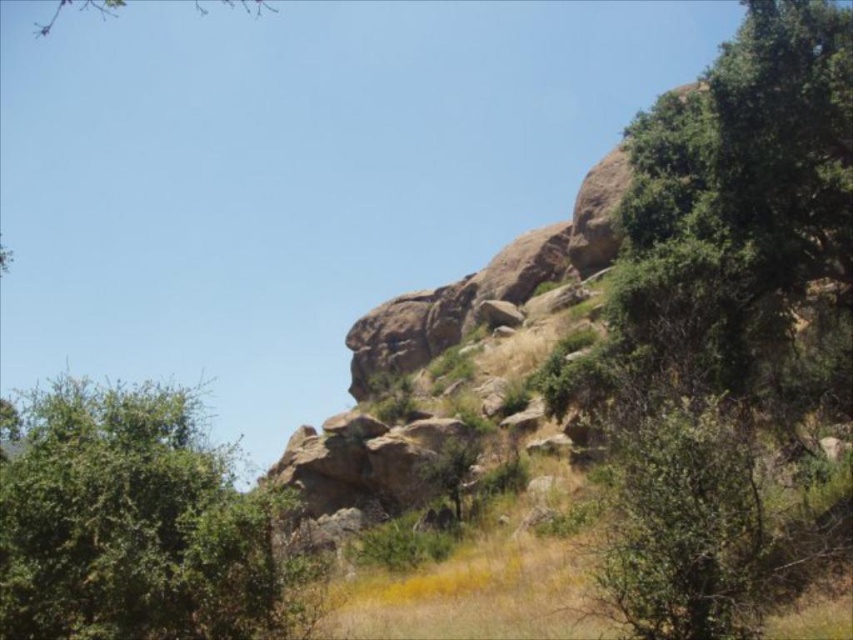
You are standing on the rocky hillside and want to pick a leaf from either the green leafy bush at left or the green leafy tree at upper left. Which one would require you to move closer to reach?

The green leafy bush at left is closer to the viewer than the green leafy tree at upper left, so you would need to move closer to reach the green leafy tree at upper left.